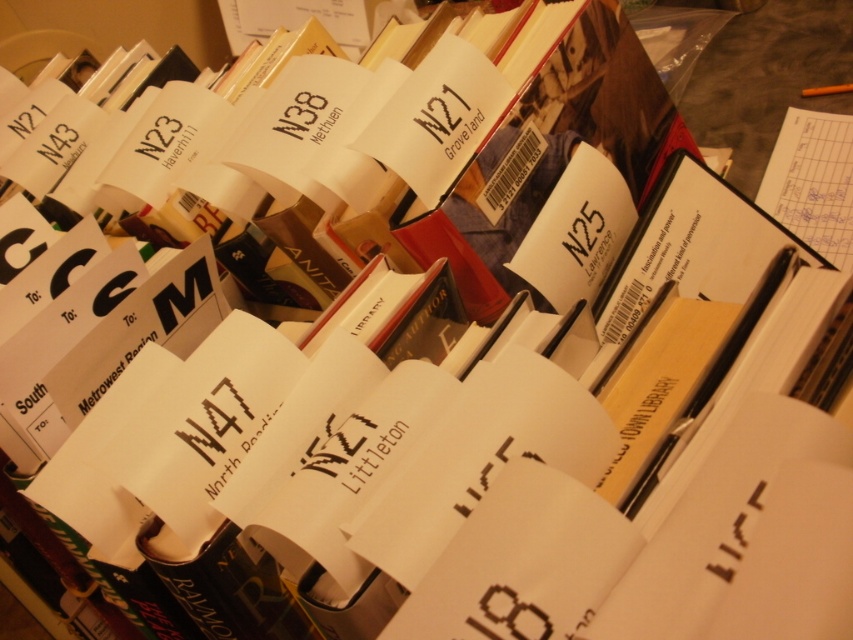
Question: Is yellow paper at right thinner than black paper at center?

Choices:
 (A) yes
 (B) no

Answer: (B)

Question: Is yellow paper at right positioned behind black paper at center?

Choices:
 (A) yes
 (B) no

Answer: (A)

Question: Which object appears farthest from the camera in this image?

Choices:
 (A) black paper at center
 (B) yellow paper at right

Answer: (B)

Question: Among these points, which one is farthest from the camera?

Choices:
 (A) pyautogui.click(x=741, y=513)
 (B) pyautogui.click(x=625, y=400)

Answer: (B)

Question: Does yellow paper at right appear under black paper at center?

Choices:
 (A) yes
 (B) no

Answer: (B)

Question: Which of the following is the closest to the observer?

Choices:
 (A) yellow paper at right
 (B) black paper at center

Answer: (B)